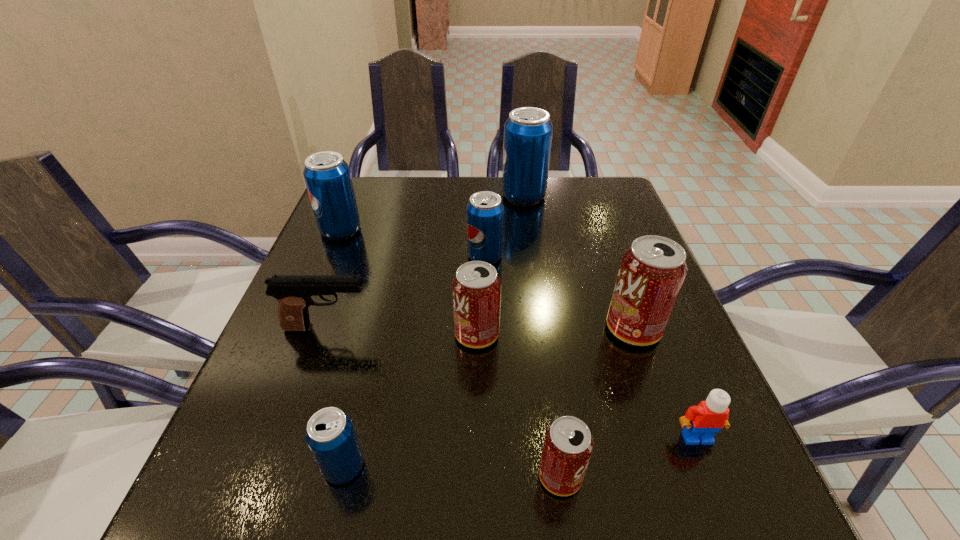
In order to click on the second soda can from left to right in this screenshot , I will do [330, 434].

Locate an element on the screen. This screenshot has height=540, width=960. the nearest blue pop soda is located at coordinates click(x=330, y=434).

Locate an element on the screen. This screenshot has width=960, height=540. the smallest red soda can is located at coordinates (568, 444).

The width and height of the screenshot is (960, 540). What are the coordinates of `the second red soda can from left to right` in the screenshot? It's located at (568, 444).

At what (x,y) coordinates should I click in order to perform the action: click on the seventh farthest object. Please return your answer as a coordinate pair (x, y). The width and height of the screenshot is (960, 540). Looking at the image, I should click on (702, 422).

Identify the location of white Lego. Image resolution: width=960 pixels, height=540 pixels. (702, 422).

At what (x,y) coordinates should I click in order to perform the action: click on vacant space positioned 0.330m on the left of the tallest object. Please return your answer as a coordinate pair (x, y). Looking at the image, I should click on (385, 196).

Where is `vacant space situated 0.340m on the right of the third smallest blue pop soda`? This screenshot has height=540, width=960. vacant space situated 0.340m on the right of the third smallest blue pop soda is located at coordinates (494, 230).

Identify the location of vacant area situated 0.340m on the back of the biggest red soda can. This screenshot has width=960, height=540. (594, 218).

This screenshot has height=540, width=960. What are the coordinates of `blank area located on the back of the leftmost red soda can` in the screenshot? It's located at (478, 224).